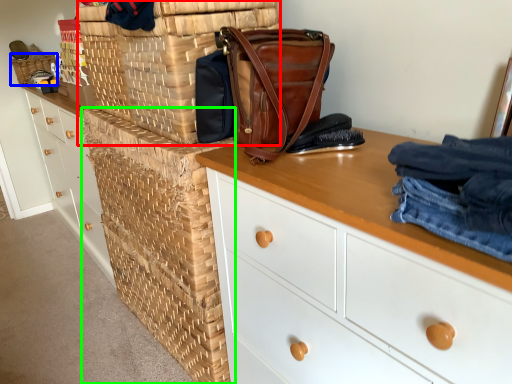
Question: Which object is positioned closest to basket (highlighted by a red box)? Select from basket (highlighted by a blue box) and crate (highlighted by a green box).

Choices:
 (A) basket
 (B) crate

Answer: (B)